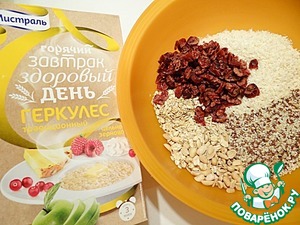
The image size is (300, 225). I want to click on box, so click(x=76, y=122).